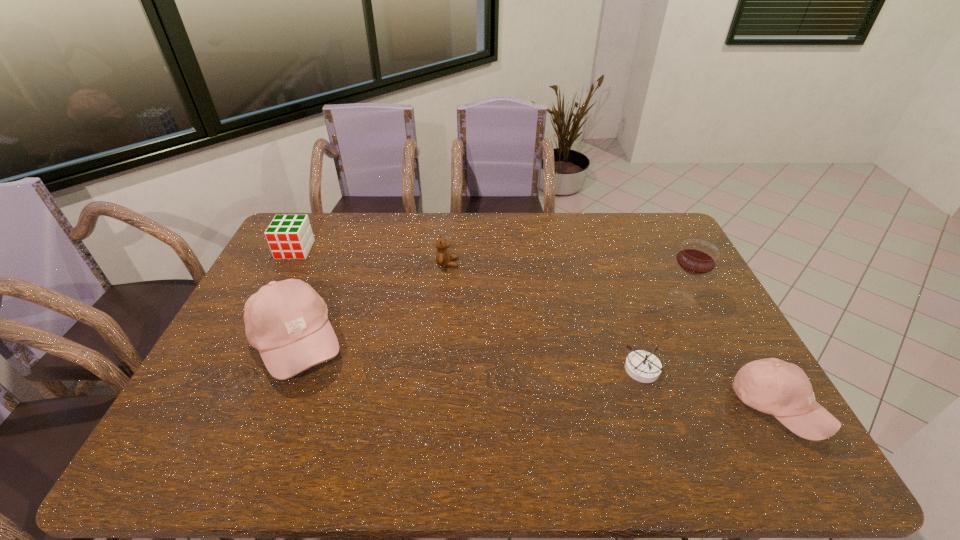
Find the location of a particular element. Image resolution: width=960 pixels, height=540 pixels. vacant space in between the teddy bear and the right baseball cap is located at coordinates (612, 335).

Where is `vacant region between the cube and the teddy bear`? Image resolution: width=960 pixels, height=540 pixels. vacant region between the cube and the teddy bear is located at coordinates (372, 256).

You are a GUI agent. You are given a task and a screenshot of the screen. Output one action in this format:
    pyautogui.click(x=<x>, y=<y>)
    Task: Click on the vacant point located between the shortest object and the taller baseball cap
    The image size is (960, 540).
    Given the screenshot: What is the action you would take?
    pyautogui.click(x=469, y=355)

The height and width of the screenshot is (540, 960). I want to click on free spot between the cube and the shorter baseball cap, so click(537, 328).

Find the location of `object that is the second nearest to the third object from left to right`. object that is the second nearest to the third object from left to right is located at coordinates (289, 236).

Locate which object ranks second in proximity to the left baseball cap. Please provide its 2D coordinates. Your answer should be formatted as a tuple, i.e. [(x, y)], where the tuple contains the x and y coordinates of a point satisfying the conditions above.

[(443, 258)]

This screenshot has height=540, width=960. In order to click on vacant space that satisfies the following two spatial constraints: 1. on the back side of the third object from right to left; 2. on the front-facing side of the teddy bear in this screenshot , I will do `click(607, 264)`.

The width and height of the screenshot is (960, 540). Find the location of `vacant region that satisfies the following two spatial constraints: 1. on the front-facing side of the fourth object from right to left; 2. on the right side of the third object from right to left`. vacant region that satisfies the following two spatial constraints: 1. on the front-facing side of the fourth object from right to left; 2. on the right side of the third object from right to left is located at coordinates (439, 368).

At what (x,y) coordinates should I click in order to perform the action: click on free space that satisfies the following two spatial constraints: 1. on the front-facing side of the teddy bear; 2. on the right side of the fourth object from left to right. Please return your answer as a coordinate pair (x, y). Image resolution: width=960 pixels, height=540 pixels. Looking at the image, I should click on (439, 368).

You are a GUI agent. You are given a task and a screenshot of the screen. Output one action in this format:
    pyautogui.click(x=<x>, y=<y>)
    Task: Click on the free spot that satisfies the following two spatial constraints: 1. on the back side of the compass; 2. on the front-facing side of the left baseball cap
    
    Given the screenshot: What is the action you would take?
    pyautogui.click(x=634, y=343)